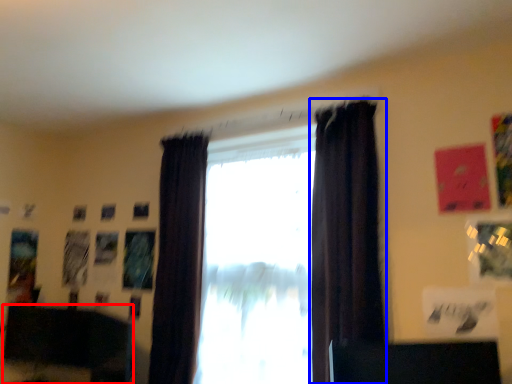
Question: Which of the following is the farthest to the observer, furniture (highlighted by a red box) or curtain (highlighted by a blue box)?

Choices:
 (A) furniture
 (B) curtain

Answer: (A)